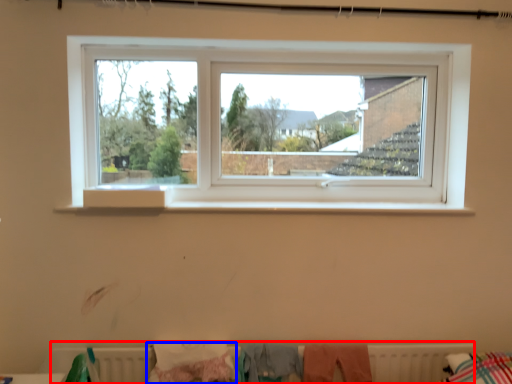
Question: Among these objects, which one is farthest to the camera, radiator (highlighted by a red box) or clothing (highlighted by a blue box)?

Choices:
 (A) radiator
 (B) clothing

Answer: (A)